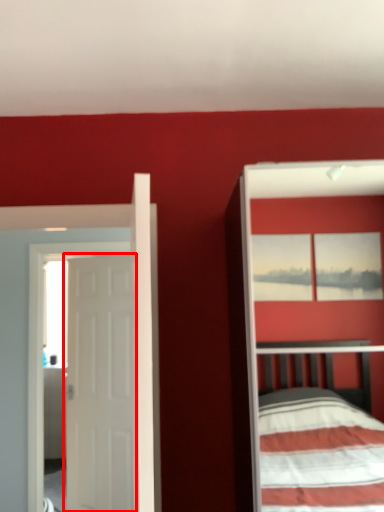
Question: From the image, what is the correct spatial relationship of door (annotated by the red box) in relation to door?

Choices:
 (A) left
 (B) right

Answer: (A)